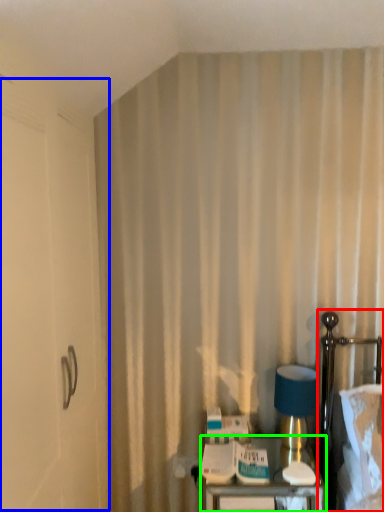
Question: Which object is positioned farthest from bed (highlighted by a red box)? Select from screen door (highlighted by a blue box) and furniture (highlighted by a green box).

Choices:
 (A) screen door
 (B) furniture

Answer: (A)